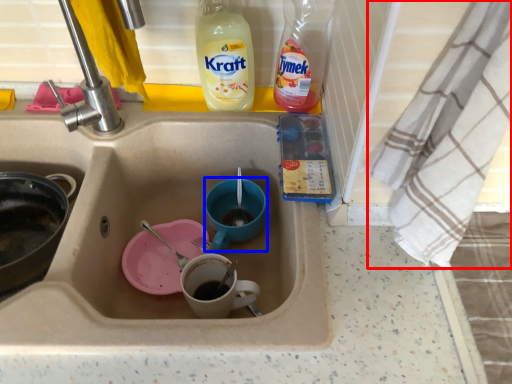
Question: Which object appears farthest to the camera in this image, cloth (highlighted by a red box) or basin (highlighted by a blue box)?

Choices:
 (A) cloth
 (B) basin

Answer: (B)